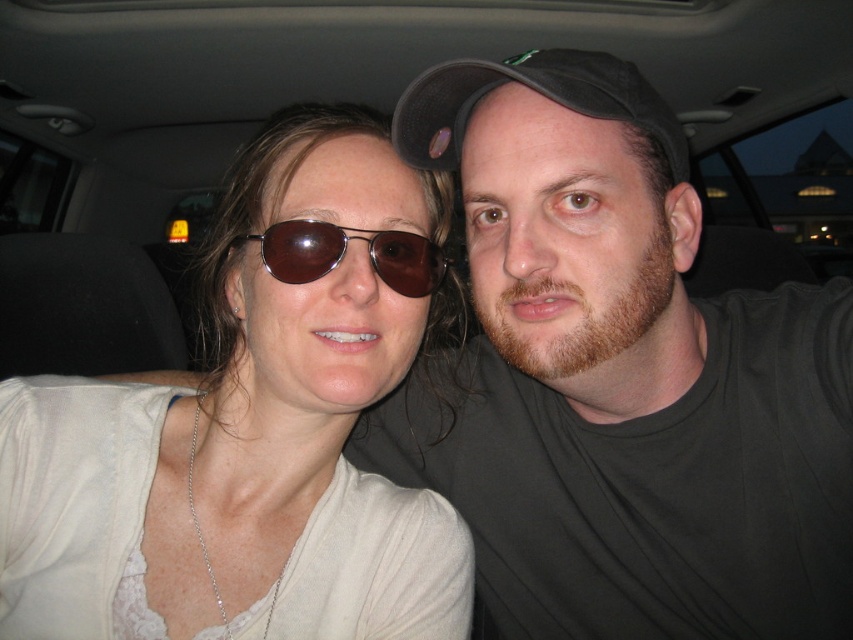
Question: Considering the relative positions of matte white shirt at left and brown reflective sunglasses at center in the image provided, where is matte white shirt at left located with respect to brown reflective sunglasses at center?

Choices:
 (A) left
 (B) right

Answer: (A)

Question: Which object is farther from the camera taking this photo?

Choices:
 (A) brown reflective sunglasses at center
 (B) black fabric baseball cap at upper center
 (C) matte white shirt at left

Answer: (A)

Question: Is matte white shirt at left smaller than black fabric baseball cap at upper center?

Choices:
 (A) yes
 (B) no

Answer: (B)

Question: Among these points, which one is farthest from the camera?

Choices:
 (A) (567, 104)
 (B) (451, 582)

Answer: (B)

Question: Is black fabric baseball cap at upper center thinner than brown reflective sunglasses at center?

Choices:
 (A) no
 (B) yes

Answer: (A)

Question: Which point is closer to the camera?

Choices:
 (A) black fabric baseball cap at upper center
 (B) matte white shirt at left

Answer: (A)